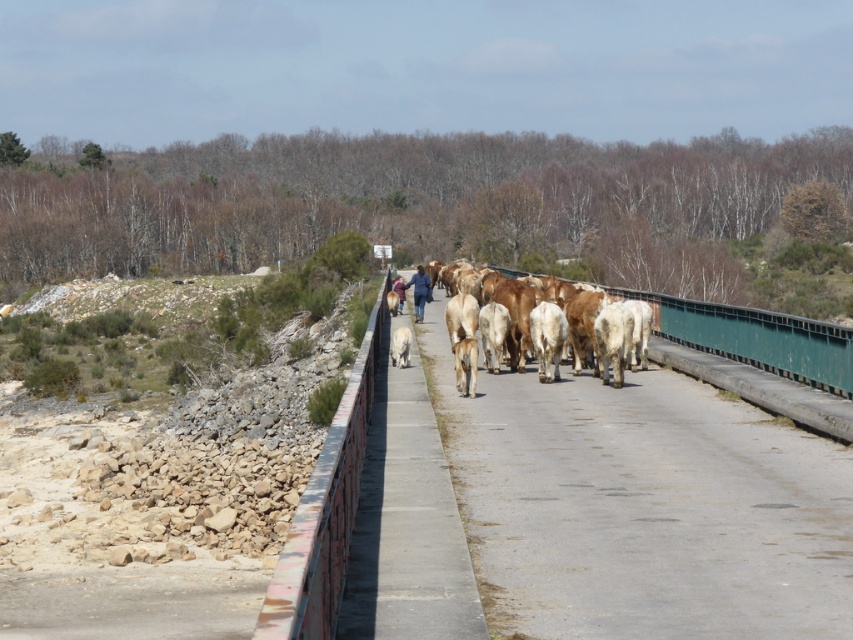
Question: Which object is positioned closest to the white fur dog at center?

Choices:
 (A) brown smooth cows at center
 (B) white smooth cow at center

Answer: (A)

Question: Is brown smooth cows at center thinner than white fur dog at center?

Choices:
 (A) yes
 (B) no

Answer: (B)

Question: Which object is the closest to the white fur dog at center?

Choices:
 (A) brown smooth cows at center
 (B) white smooth cow at center

Answer: (A)

Question: Can you confirm if brown smooth cows at center is positioned to the left of white smooth cow at center?

Choices:
 (A) no
 (B) yes

Answer: (A)

Question: Considering the relative positions of brown smooth cows at center and white fur dog at center in the image provided, where is brown smooth cows at center located with respect to white fur dog at center?

Choices:
 (A) above
 (B) below

Answer: (A)

Question: Among these points, which one is nearest to the camera?

Choices:
 (A) (457, 365)
 (B) (403, 346)

Answer: (A)